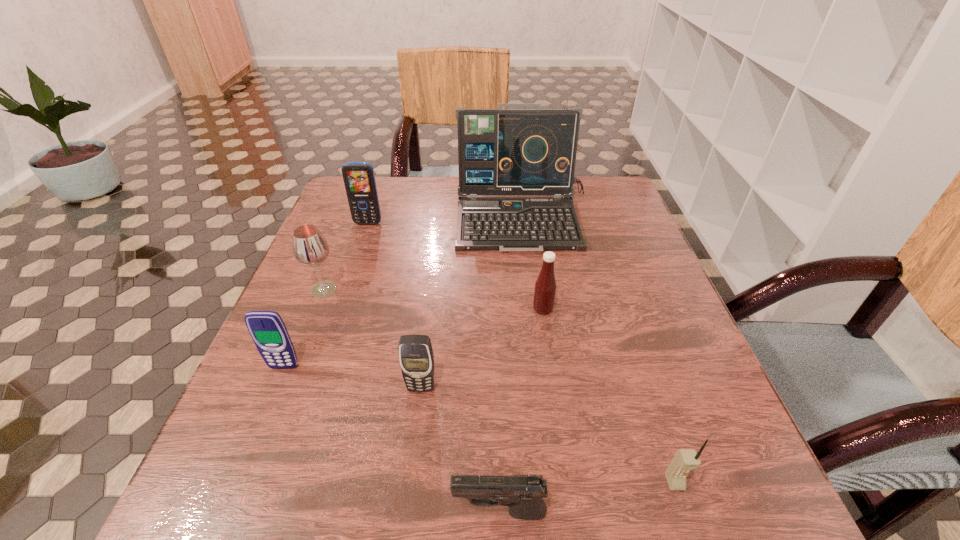
The height and width of the screenshot is (540, 960). I want to click on the shortest object, so click(x=523, y=494).

I want to click on free location located on the front-facing side of the laptop computer, so click(x=544, y=384).

This screenshot has height=540, width=960. Identify the location of vacant space located 0.200m on the screen of the farthest cellular telephone. (350, 276).

This screenshot has width=960, height=540. I want to click on vacant area located 0.240m on the front of the sixth nearest object, so click(x=280, y=397).

I want to click on vacant space located 0.170m on the front of the fifth nearest object, so click(554, 386).

The width and height of the screenshot is (960, 540). I want to click on vacant space located 0.170m on the front-facing side of the second farthest cellular telephone, so click(246, 460).

This screenshot has width=960, height=540. In order to click on free region located on the front face of the third farthest cellular telephone in this screenshot , I will do `click(408, 494)`.

I want to click on vacant area located at the barrel of the shortest object, so click(x=218, y=513).

Find the location of a particular element. vacant area situated at the barrel of the shortest object is located at coordinates (260, 513).

What are the coordinates of `free space located 0.230m at the barrel of the shortest object` in the screenshot? It's located at (289, 513).